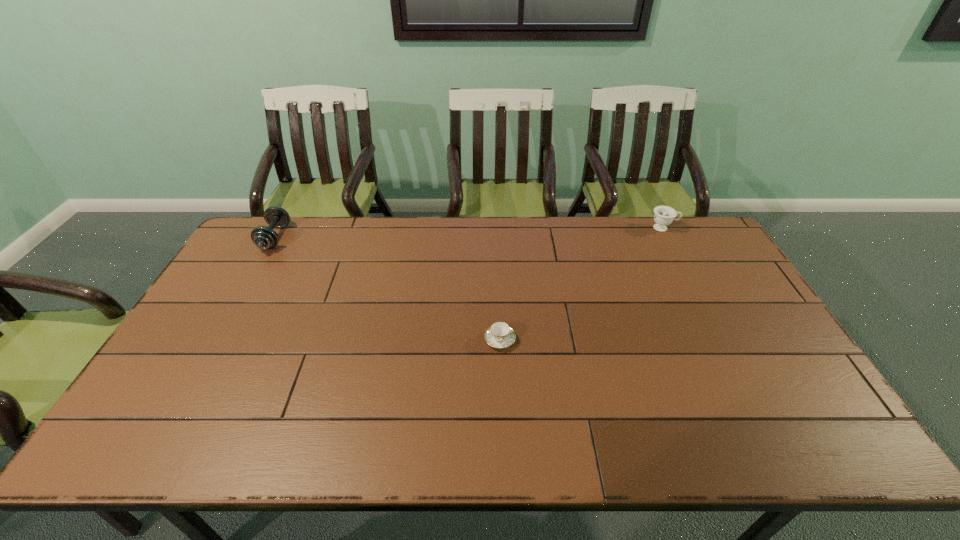
Locate an element on the screen. This screenshot has width=960, height=540. unoccupied position between the shortest object and the rightmost object is located at coordinates (582, 284).

Locate an element on the screen. Image resolution: width=960 pixels, height=540 pixels. free space between the shortest object and the leftmost object is located at coordinates (388, 289).

Where is `free space between the shortest object and the dumbbell`? free space between the shortest object and the dumbbell is located at coordinates (388, 289).

This screenshot has height=540, width=960. Identify the location of free point between the nearer teacup and the dumbbell. (388, 289).

Locate an element on the screen. free point between the rightmost object and the dumbbell is located at coordinates (469, 233).

Locate an element on the screen. The height and width of the screenshot is (540, 960). free spot between the leftmost object and the right teacup is located at coordinates (469, 233).

The image size is (960, 540). Identify the location of vacant area that lies between the rightmost object and the left teacup. (582, 284).

Locate an element on the screen. Image resolution: width=960 pixels, height=540 pixels. free space between the leftmost object and the right teacup is located at coordinates (469, 233).

You are a GUI agent. You are given a task and a screenshot of the screen. Output one action in this format:
    pyautogui.click(x=<x>, y=<y>)
    Task: Click on the unoccupied position between the nearest object and the farther teacup
    
    Given the screenshot: What is the action you would take?
    pyautogui.click(x=582, y=284)

Choose which object is the nearest neighbor to the tallest object. Please provide its 2D coordinates. Your answer should be formatted as a tuple, i.e. [(x, y)], where the tuple contains the x and y coordinates of a point satisfying the conditions above.

[(499, 335)]